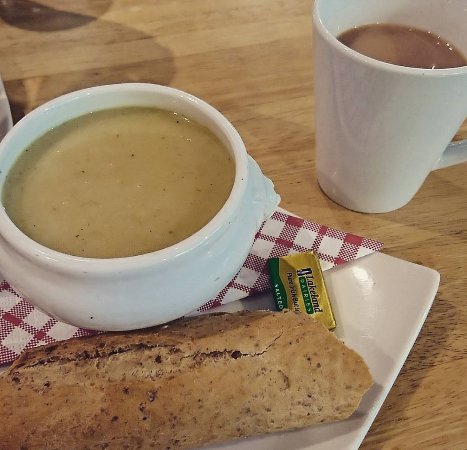
Where is `mug`? The height and width of the screenshot is (450, 467). mug is located at coordinates (404, 137).